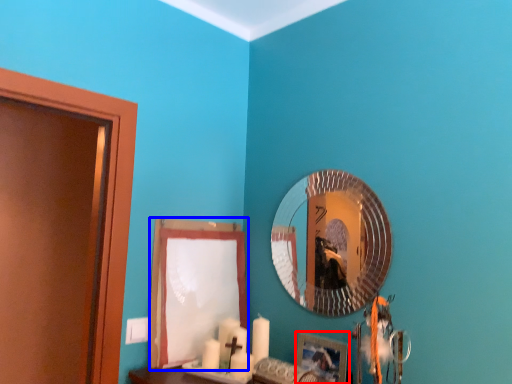
Question: Which object appears closest to the camera in this image, picture frame (highlighted by a red box) or curtain (highlighted by a blue box)?

Choices:
 (A) picture frame
 (B) curtain

Answer: (A)